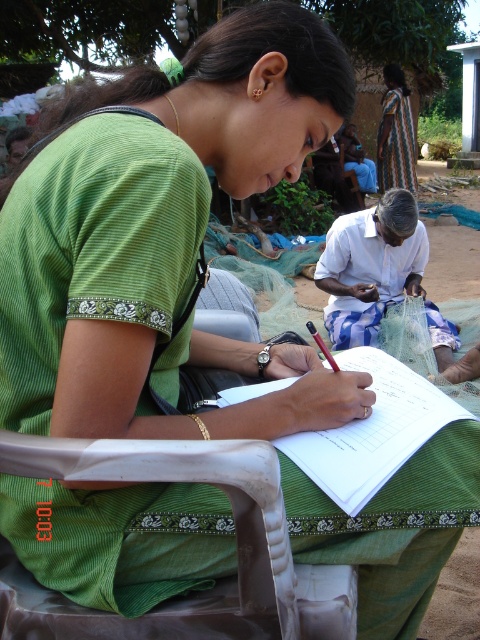
Which is in front, point (374, 476) or point (393, 116)?

Positioned in front is point (374, 476).

Measure the distance between white paper at center and camera.

29.92 inches

Identify the location of white paper at center. (372, 429).